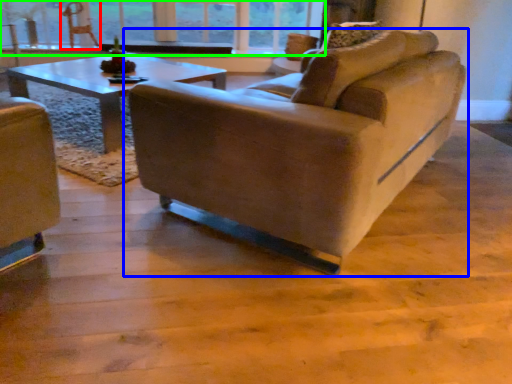
Question: Which object is the closest to the swivel chair (highlighted by a red box)? Choose among these: studio couch (highlighted by a blue box) or window (highlighted by a green box).

Choices:
 (A) studio couch
 (B) window

Answer: (B)